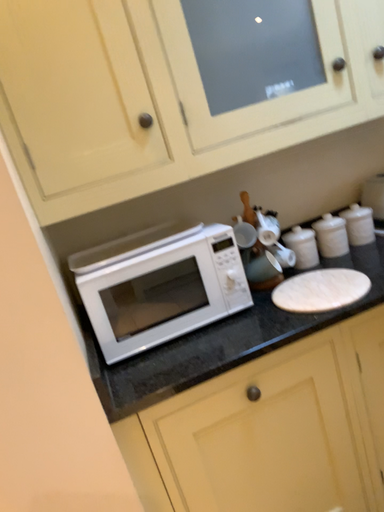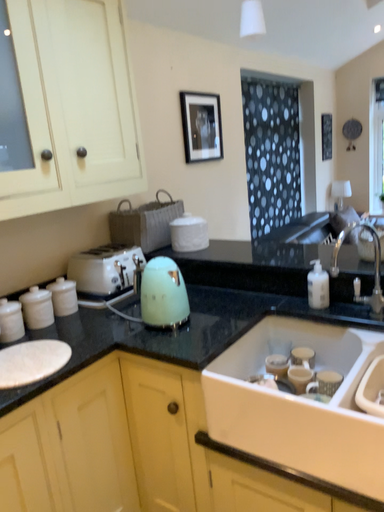
Question: How did the camera likely rotate when shooting the video?

Choices:
 (A) rotated upward
 (B) rotated downward

Answer: (A)